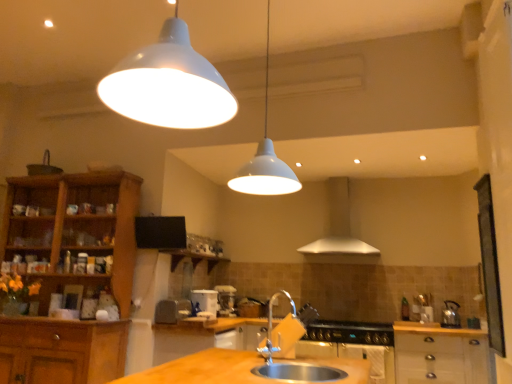
Question: From a real-world perspective, is stainless steel oven at lower center positioned under black matte gas stove at lower center based on gravity?

Choices:
 (A) no
 (B) yes

Answer: (B)

Question: Is the depth of stainless steel oven at lower center greater than that of black matte gas stove at lower center?

Choices:
 (A) no
 (B) yes

Answer: (A)

Question: From a real-world perspective, is stainless steel oven at lower center located higher than black matte gas stove at lower center?

Choices:
 (A) yes
 (B) no

Answer: (B)

Question: Would you say stainless steel oven at lower center contains black matte gas stove at lower center?

Choices:
 (A) no
 (B) yes

Answer: (A)

Question: Can you confirm if stainless steel oven at lower center is positioned to the right of black matte gas stove at lower center?

Choices:
 (A) yes
 (B) no

Answer: (B)

Question: Considering the relative positions of white matte pendant light at upper center and silver metallic exhaust hood at center in the image provided, is white matte pendant light at upper center to the left or to the right of silver metallic exhaust hood at center?

Choices:
 (A) left
 (B) right

Answer: (A)

Question: Is point (266, 56) positioned closer to the camera than point (343, 211)?

Choices:
 (A) farther
 (B) closer

Answer: (B)

Question: From the image's perspective, is white matte pendant light at upper center positioned above or below silver metallic exhaust hood at center?

Choices:
 (A) below
 (B) above

Answer: (B)

Question: In terms of height, does white matte pendant light at upper center look taller or shorter compared to silver metallic exhaust hood at center?

Choices:
 (A) short
 (B) tall

Answer: (B)

Question: Would you say silver metallic sink at lower center is to the left or to the right of wooden cabinet at lower right, placed as the second cabinetry when sorted from left to right, in the picture?

Choices:
 (A) right
 (B) left

Answer: (B)

Question: Is silver metallic sink at lower center situated inside wooden cabinet at lower right, positioned as the first cabinetry in right-to-left order, or outside?

Choices:
 (A) inside
 (B) outside

Answer: (B)

Question: From the image's perspective, is silver metallic sink at lower center above or below wooden cabinet at lower right, positioned as the first cabinetry in right-to-left order?

Choices:
 (A) below
 (B) above

Answer: (B)

Question: Considering the positions of silver metallic sink at lower center and wooden cabinet at lower right, placed as the second cabinetry when sorted from left to right, in the image, is silver metallic sink at lower center bigger or smaller than wooden cabinet at lower right, placed as the second cabinetry when sorted from left to right,?

Choices:
 (A) big
 (B) small

Answer: (B)

Question: Is black matte gas stove at lower center inside the boundaries of silver metallic sink at lower center, or outside?

Choices:
 (A) inside
 (B) outside

Answer: (B)

Question: From the image's perspective, is black matte gas stove at lower center above or below silver metallic sink at lower center?

Choices:
 (A) above
 (B) below

Answer: (B)